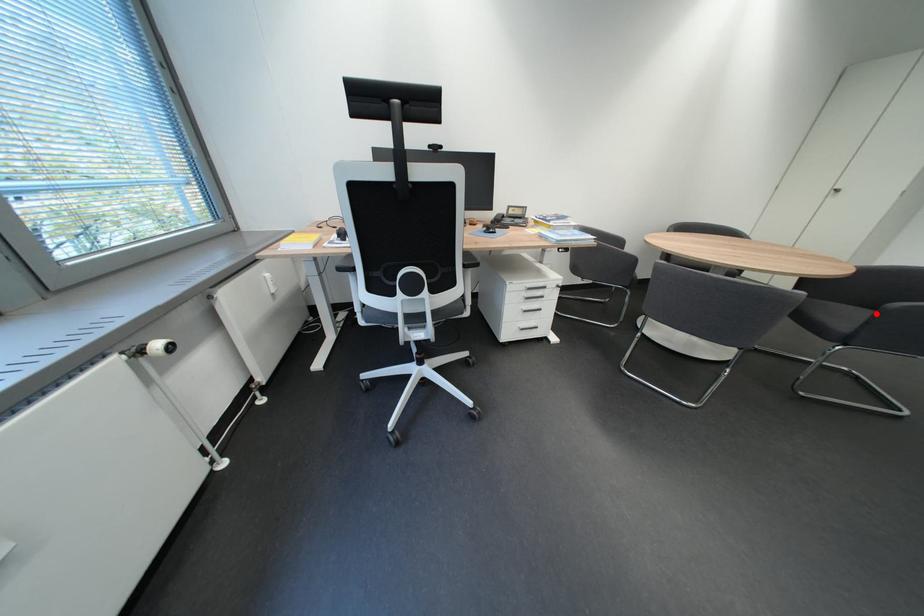
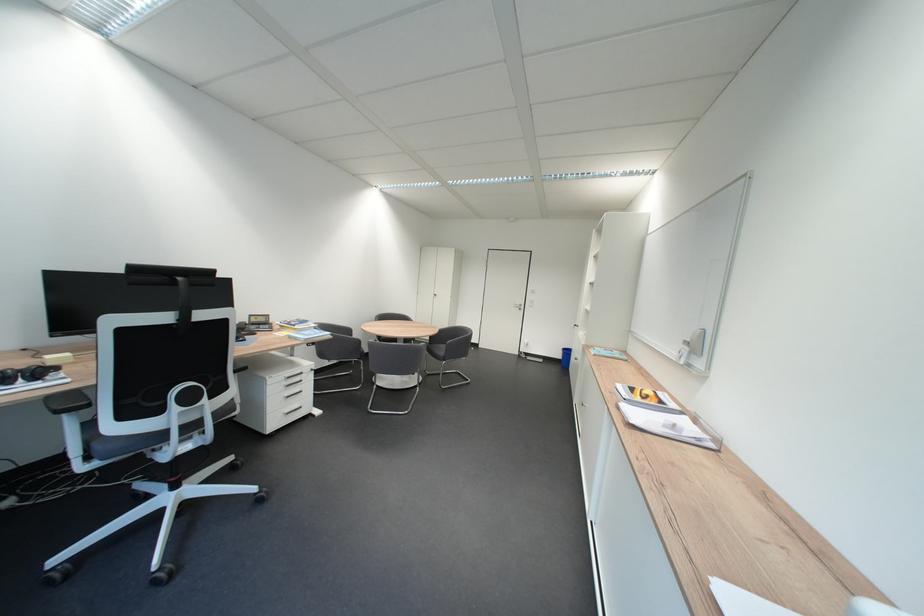
Question: I am providing you with two images of the same scene from different viewpoints. Given a red point in image1, look at the same physical point in image2. Is it:

Choices:
 (A) Closer to the viewpoint
 (B) Farther from the viewpoint

Answer: (A)